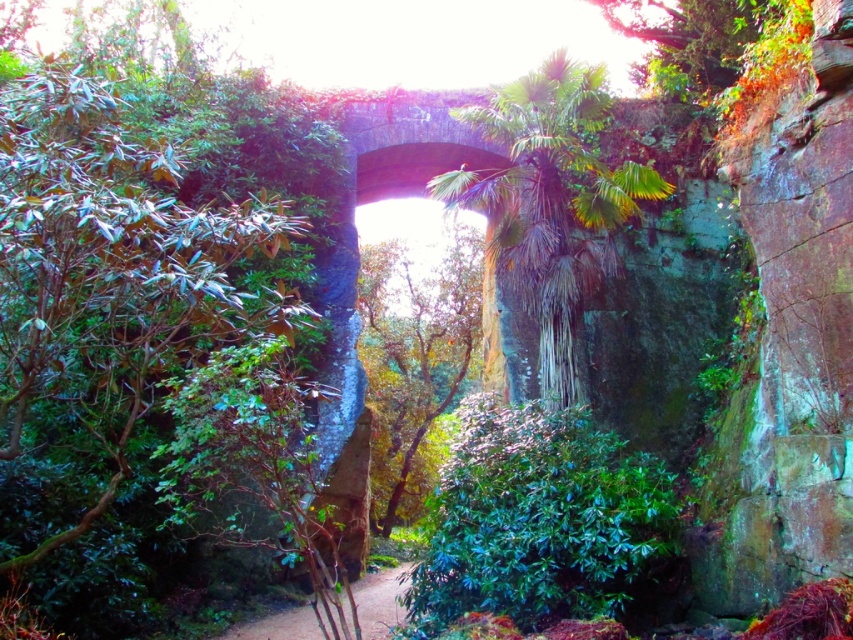
You are a gardener planning to place a decorative stone statue between the green leafy bush at left and the green leafy tree at upper center. The statue requires a space that is at least as wide as the wider of the two. Which object determines the minimum width required for the statue placement?

The green leafy bush at left might be wider than green leafy tree at upper center, so the statue should be placed with the minimum width based on the green leafy bush at left to ensure it fits properly.

Consider the image. You are a gardener planning to trim the bushes in the scene. The green leafy bush at left and the green glossy bush at center are both in your path. Which bush do you need to trim more to widen your path?

The green leafy bush at left has a greater width than the green glossy bush at center, so you should trim the green leafy bush at left more to widen your path.